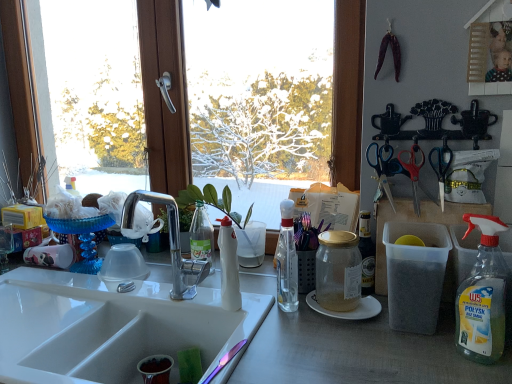
This screenshot has height=384, width=512. I want to click on free space in front of white paper plate at center, so click(x=359, y=347).